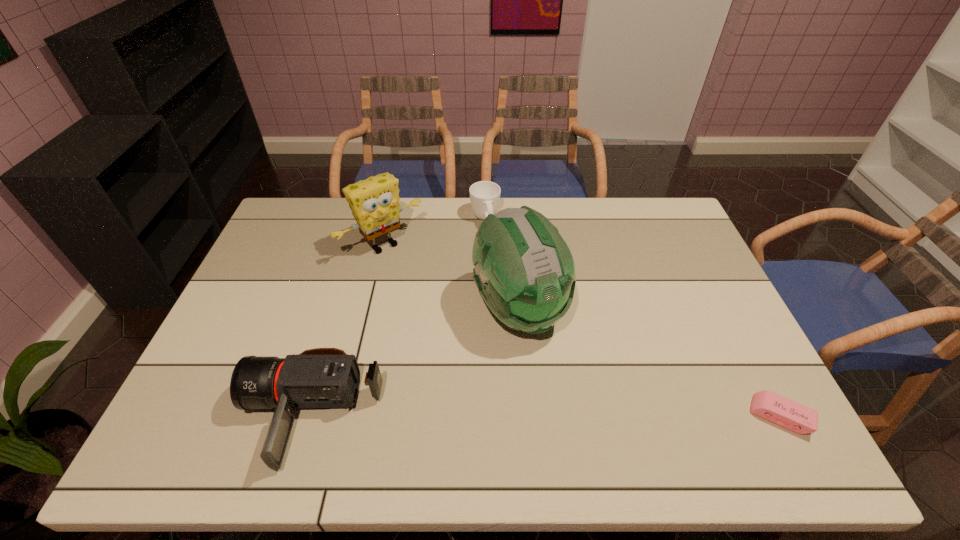
Identify the location of object that is the closest one to the cup. (374, 202).

Identify which object is the fourth closest to the shortest object. Please provide its 2D coordinates. Your answer should be formatted as a tuple, i.e. [(x, y)], where the tuple contains the x and y coordinates of a point satisfying the conditions above.

[(374, 202)]

You are a GUI agent. You are given a task and a screenshot of the screen. Output one action in this format:
    pyautogui.click(x=<x>, y=<y>)
    Task: Click on the vacant space that satisfies the following two spatial constraints: 1. on the back side of the sponge; 2. on the left side of the cup
    The image size is (960, 540).
    Given the screenshot: What is the action you would take?
    pyautogui.click(x=390, y=219)